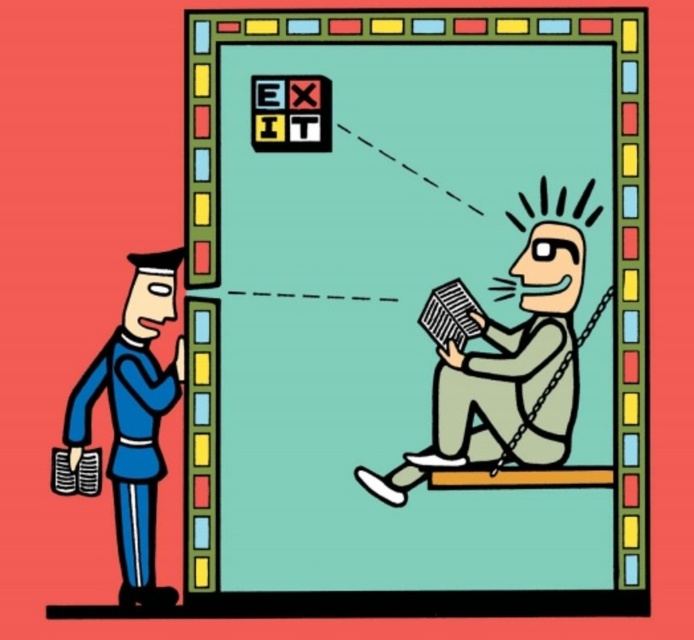
Does matte gray book at center appear on the right side of gray matte book at center?

In fact, matte gray book at center is to the left of gray matte book at center.

Is matte gray book at center shorter than gray matte book at center?

No, matte gray book at center is not shorter than gray matte book at center.

Locate an element on the screen. matte gray book at center is located at coordinates (416, 310).

Find the location of `matte gray book at center`. matte gray book at center is located at coordinates (416, 310).

Can you confirm if gray matte book at center is positioned to the left of blue fabric uniform at left?

No, gray matte book at center is not to the left of blue fabric uniform at left.

Looking at this image, can you confirm if gray matte book at center is thinner than blue fabric uniform at left?

No, gray matte book at center is not thinner than blue fabric uniform at left.

The image size is (694, 640). What do you see at coordinates (502, 371) in the screenshot?
I see `gray matte book at center` at bounding box center [502, 371].

Where is `gray matte book at center`? This screenshot has width=694, height=640. gray matte book at center is located at coordinates (502, 371).

Between matte gray book at center and blue fabric uniform at left, which one is positioned higher?

matte gray book at center is above.

Who is shorter, matte gray book at center or blue fabric uniform at left?

With less height is blue fabric uniform at left.

Is point (496, 540) positioned after point (139, 397)?

Yes.

Locate an element on the screen. This screenshot has width=694, height=640. matte gray book at center is located at coordinates (416, 310).